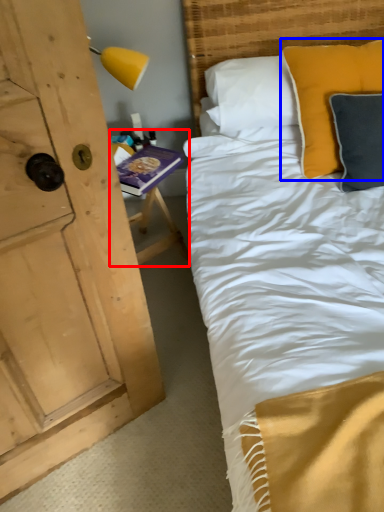
Question: Among these objects, which one is farthest to the camera, table (highlighted by a red box) or pillow (highlighted by a blue box)?

Choices:
 (A) table
 (B) pillow

Answer: (A)